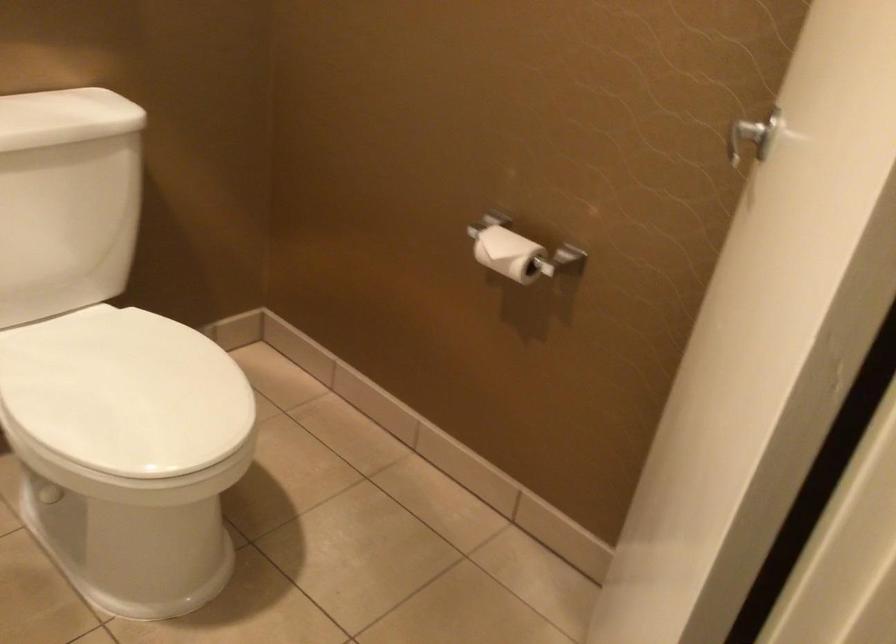
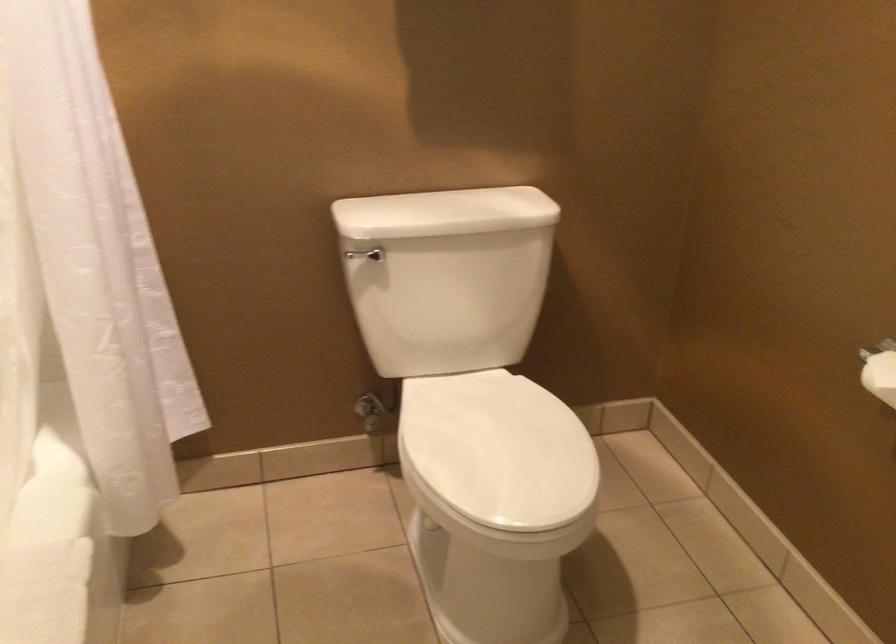
The point at (492, 249) is marked in the first image. Where is the corresponding point in the second image?

(880, 375)